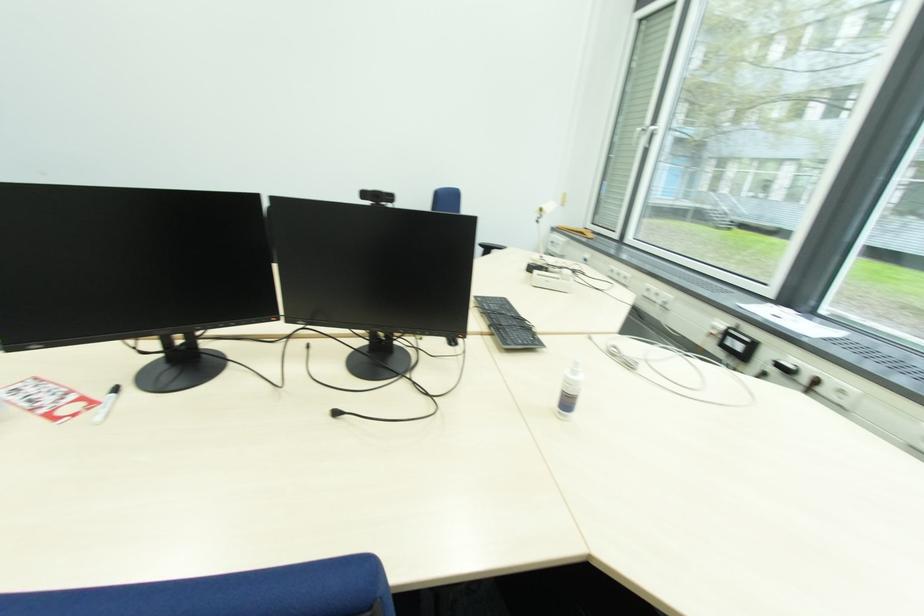
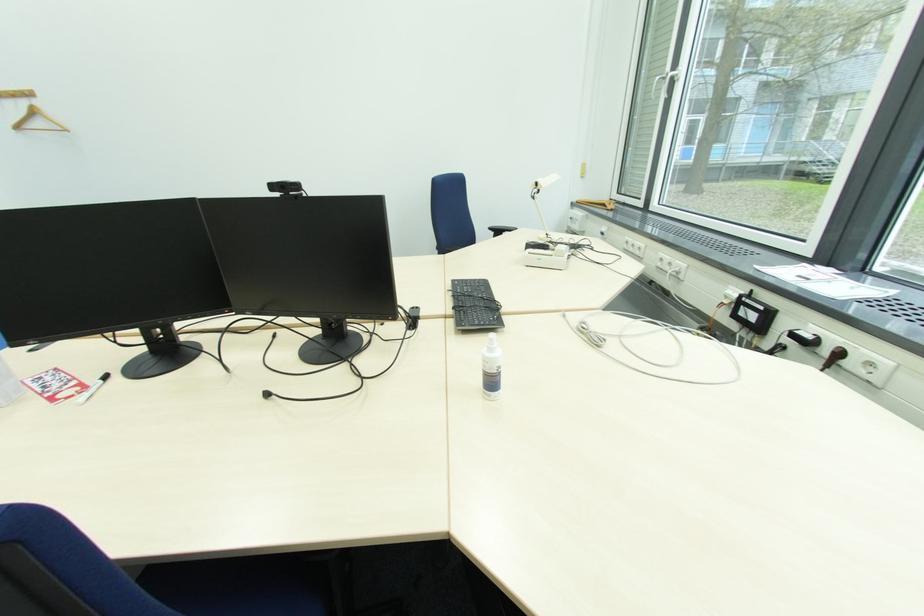
In the second image, find the point that corresponds to (x=545, y=213) in the first image.

(541, 185)